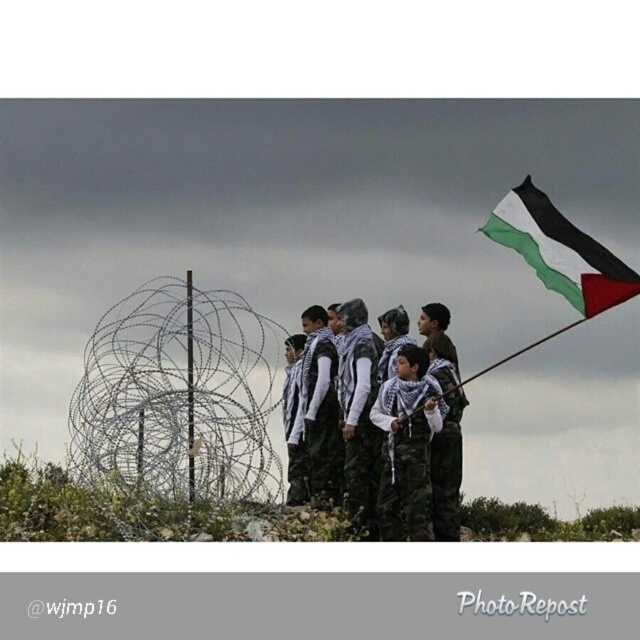
How far apart are black and white fabric flag at upper right and camouflage pants at center?

A distance of 4.96 meters exists between black and white fabric flag at upper right and camouflage pants at center.

Between point (552, 227) and point (397, 515), which one is positioned in front?

Point (397, 515) is in front.

Find the location of a particular element. black and white fabric flag at upper right is located at coordinates (560, 252).

Which is in front, point (410, 406) or point (362, 509)?

Positioned in front is point (410, 406).

Is camouflage pants at center to the right of camouflage fabric uniform at center from the viewer's perspective?

Yes, camouflage pants at center is to the right of camouflage fabric uniform at center.

Is point (380, 490) in front of point (348, 509)?

No, it is not.

I want to click on camouflage pants at center, so click(406, 445).

Which of these two, camouflage fabric uniform at center or white matte uniform at center, stands shorter?

white matte uniform at center is shorter.

Measure the distance between point (364, 323) and camera.

40.41 meters

At what (x,y) coordinates should I click in order to perform the action: click on camouflage fabric uniform at center. Please return your answer as a coordinate pair (x, y). The width and height of the screenshot is (640, 640). Looking at the image, I should click on (358, 417).

The image size is (640, 640). In order to click on camouflage fabric uniform at center in this screenshot , I will do `click(358, 417)`.